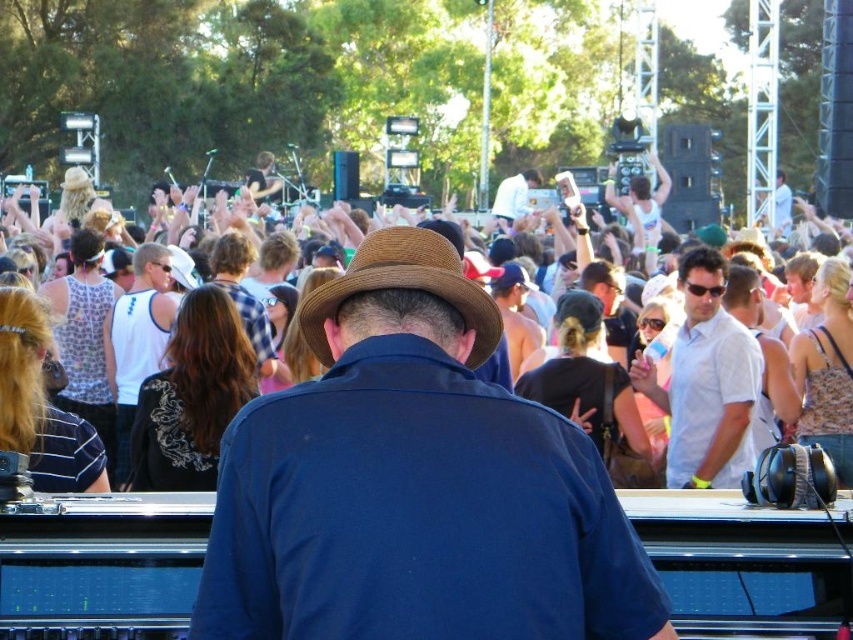
You are a photographer at the music festival and want to capture both the white cotton shirt at center and the white tank top at center in your shot. Which clothing item is shorter in height?

The white cotton shirt at center has a lesser height compared to the white tank top at center, so the white cotton shirt at center is shorter in height.

You are standing at the DJ booth and want to move towards the point that is closer to you. Which point should you move towards, point (141, 332) or point (840, 291)?

Point (141, 332) is closer to you because it is further to the viewer than point (840, 291).

You are a photographer at the music festival and want to capture both the matte brown hat at center and the brown felt fedora at center in a single shot. Which hat should you position on the left side of the frame to include both?

To include both the matte brown hat at center and the brown felt fedora at center in a single shot, position the brown felt fedora at center on the left side of the frame since the matte brown hat at center is to the right of it.